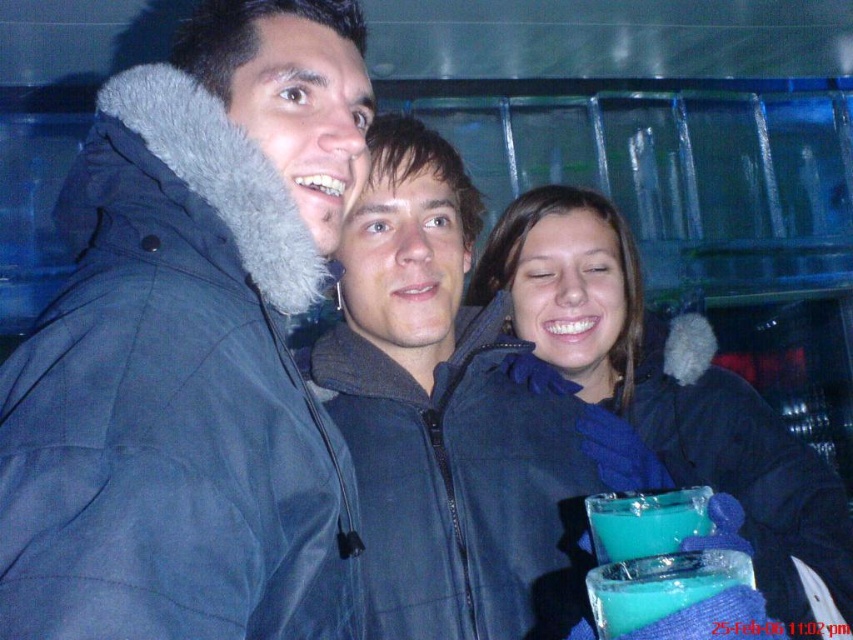
Does dark blue puffy jacket at left come in front of blue fleece scarf at center?

Yes, it is.

Does dark blue puffy jacket at left appear on the left side of blue fleece scarf at center?

Yes, dark blue puffy jacket at left is to the left of blue fleece scarf at center.

Between point (184, 333) and point (807, 593), which one is positioned behind?

Point (807, 593)

Where is `dark blue puffy jacket at left`? dark blue puffy jacket at left is located at coordinates (192, 349).